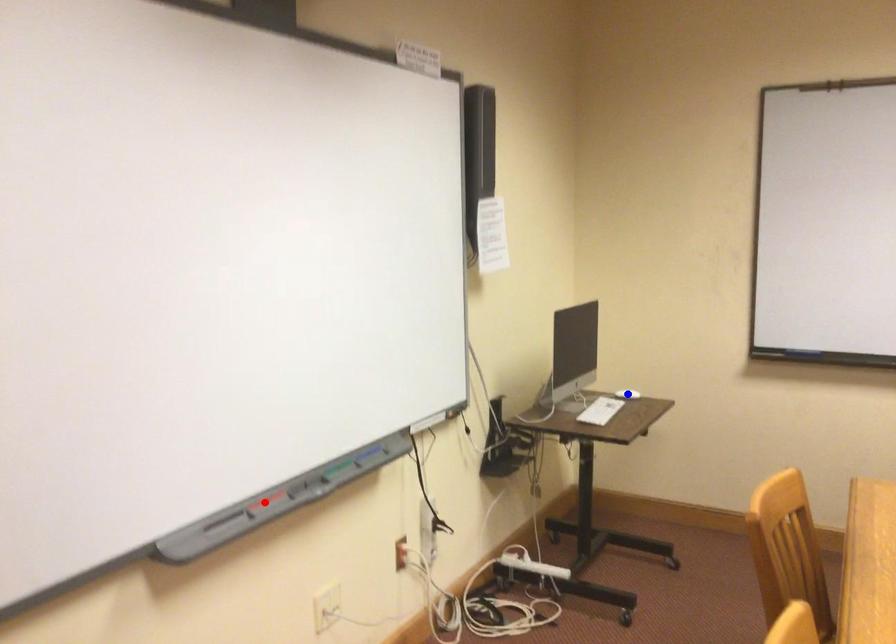
Question: Which of the two points in the image is closer to the camera?

Choices:
 (A) Blue point is closer.
 (B) Red point is closer.

Answer: (B)